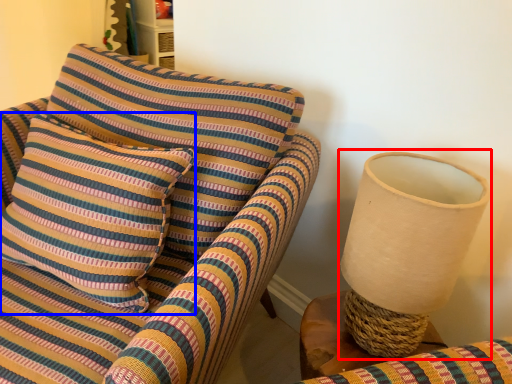
Question: Which point is closer to the camera, table lamp (highlighted by a red box) or pillow (highlighted by a blue box)?

Choices:
 (A) table lamp
 (B) pillow

Answer: (A)